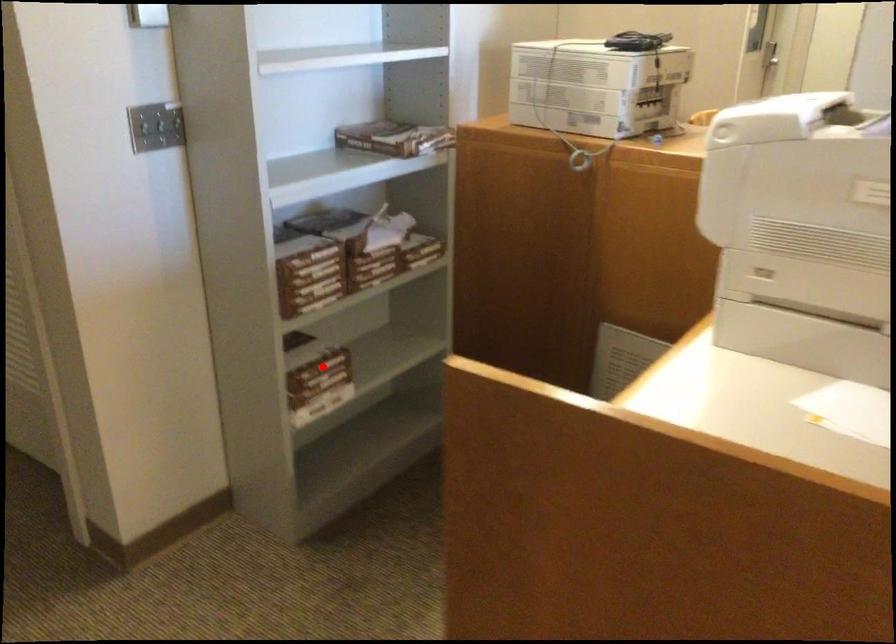
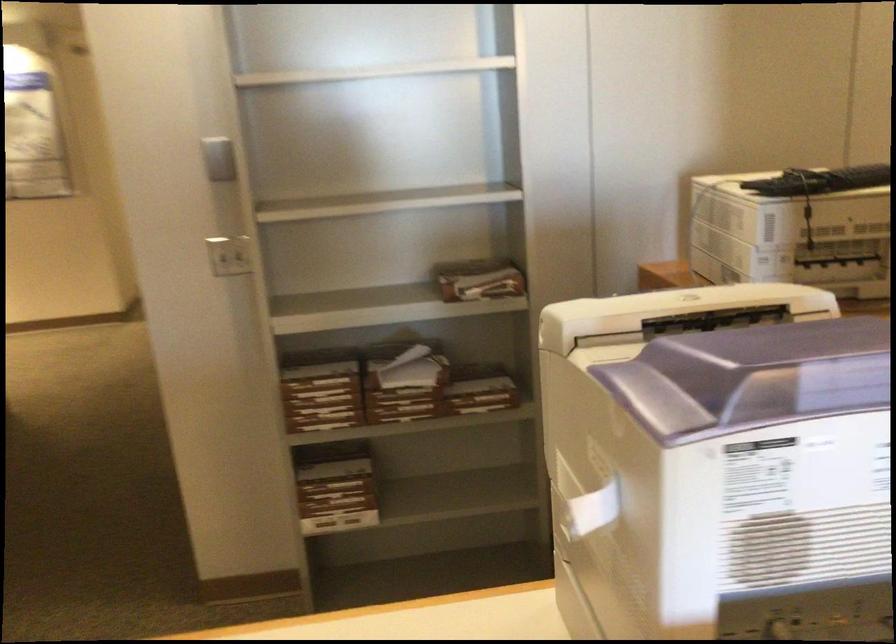
Where in the second image is the point corresponding to the highlighted location from the first image?

(334, 488)